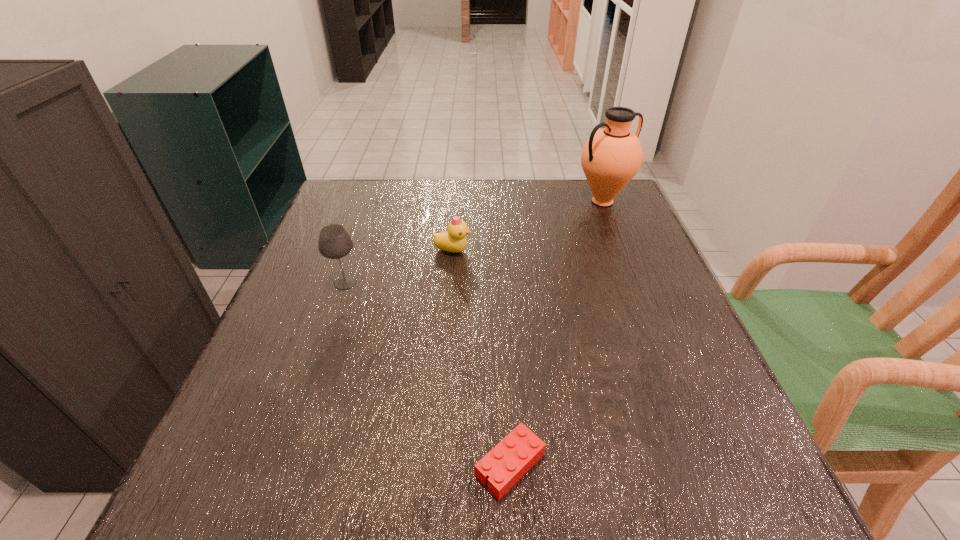
Find the location of a particular element. the farthest object is located at coordinates (611, 157).

Find the location of `the rightmost object`. the rightmost object is located at coordinates (611, 157).

Find the location of a particular element. Image resolution: width=960 pixels, height=540 pixels. the leftmost object is located at coordinates [x=334, y=242].

What are the coordinates of `the third shortest object` in the screenshot? It's located at (334, 242).

At what (x,y) coordinates should I click in order to perform the action: click on duckling. Please return your answer as a coordinate pair (x, y). The image size is (960, 540). Looking at the image, I should click on (454, 240).

At what (x,y) coordinates should I click in order to perform the action: click on the second farthest object. Please return your answer as a coordinate pair (x, y). The height and width of the screenshot is (540, 960). Looking at the image, I should click on 454,240.

At what (x,y) coordinates should I click in order to perform the action: click on Lego. Please return your answer as a coordinate pair (x, y). Looking at the image, I should click on (515, 455).

You are a GUI agent. You are given a task and a screenshot of the screen. Output one action in this format:
    pyautogui.click(x=<x>, y=<y>)
    Task: Click on the second object from right to left
    
    Given the screenshot: What is the action you would take?
    (515, 455)

What are the coordinates of `free spot located 0.340m on the left of the farthest object` in the screenshot? It's located at (453, 201).

Find the location of a particular element. This screenshot has height=540, width=960. free location located on the front of the third farthest object is located at coordinates (299, 417).